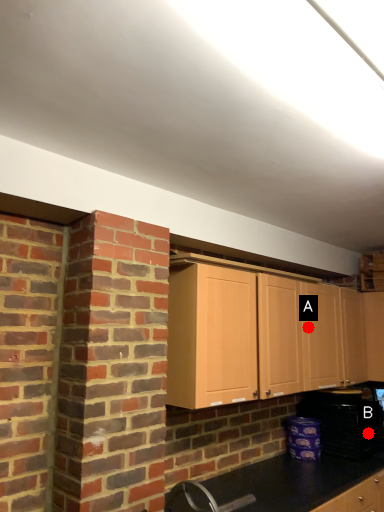
Question: Two points are circled on the image, labeled by A and B beside each circle. Which point is closer to the camera?

Choices:
 (A) A is closer
 (B) B is closer

Answer: (A)